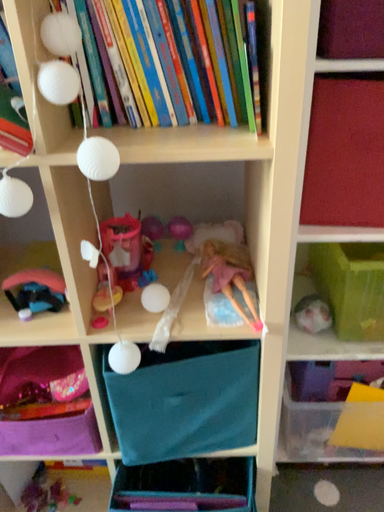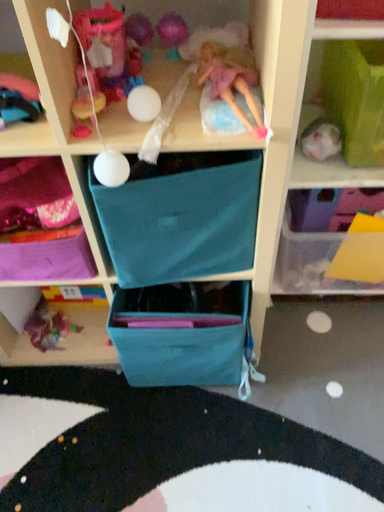
Question: Which way did the camera rotate in the video?

Choices:
 (A) rotated upward
 (B) rotated downward

Answer: (B)